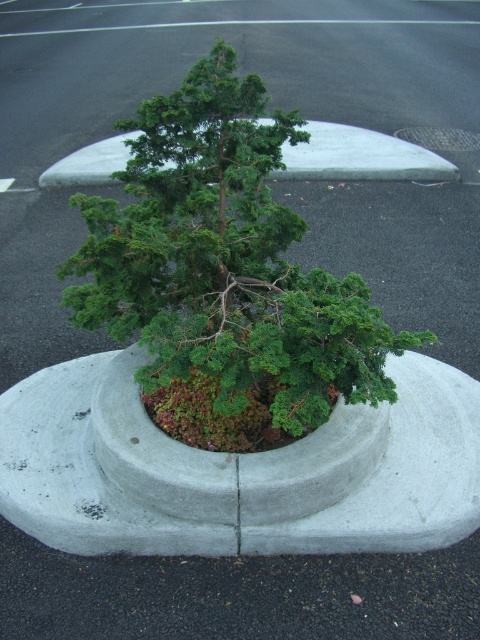
Question: Which is farther from the gray concrete planter at center?

Choices:
 (A) green matte tree at center
 (B) concrete at center

Answer: (B)

Question: Can you confirm if green matte tree at center is bigger than gray concrete planter at center?

Choices:
 (A) yes
 (B) no

Answer: (B)

Question: Considering the real-world distances, which object is closest to the concrete at center?

Choices:
 (A) green matte tree at center
 (B) gray concrete planter at center

Answer: (B)

Question: Which of the following is the closest to the observer?

Choices:
 (A) concrete at center
 (B) green matte tree at center

Answer: (B)

Question: Is green matte tree at center smaller than concrete at center?

Choices:
 (A) no
 (B) yes

Answer: (B)

Question: Is gray concrete planter at center positioned in front of concrete at center?

Choices:
 (A) yes
 (B) no

Answer: (A)